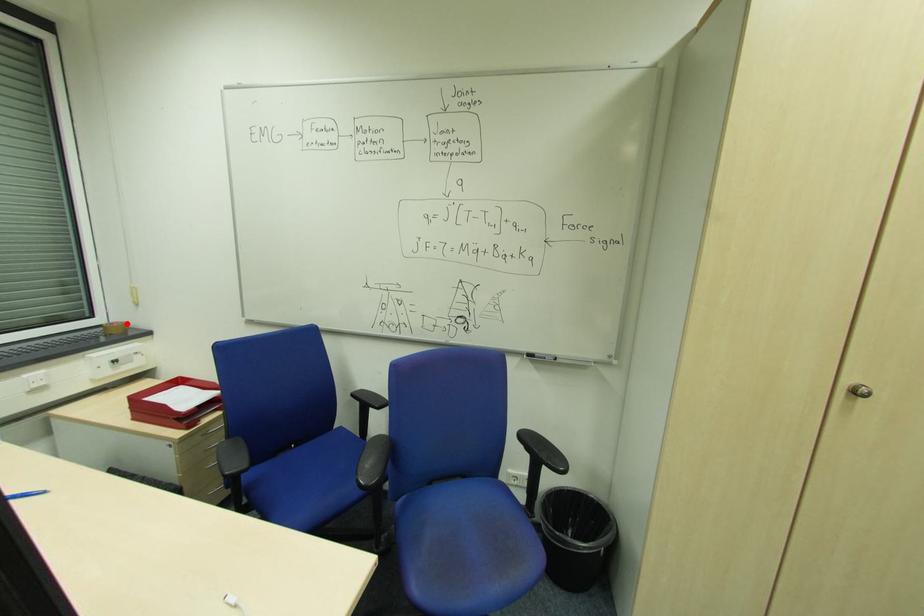
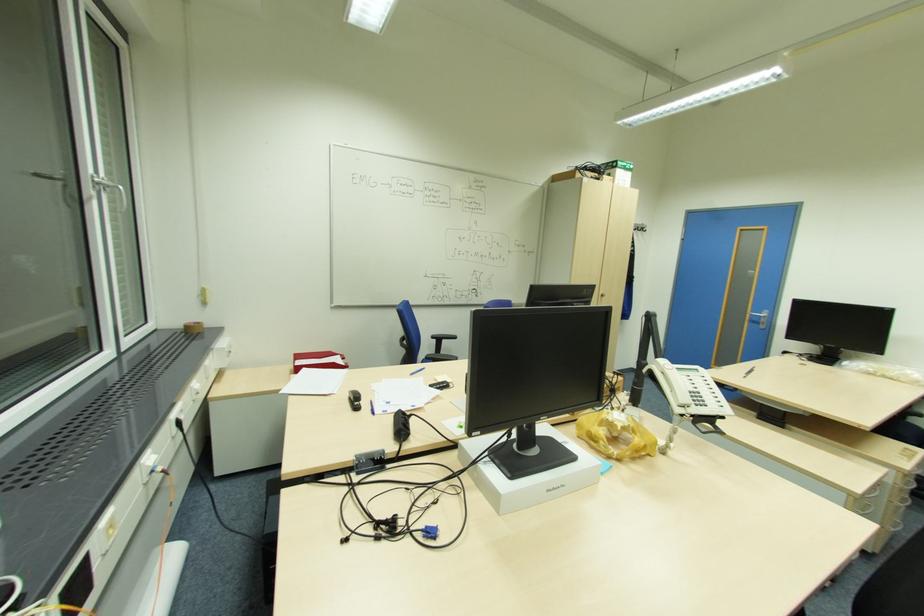
Locate, in the second image, the point that corresponds to the highlighted location in the first image.

(201, 323)